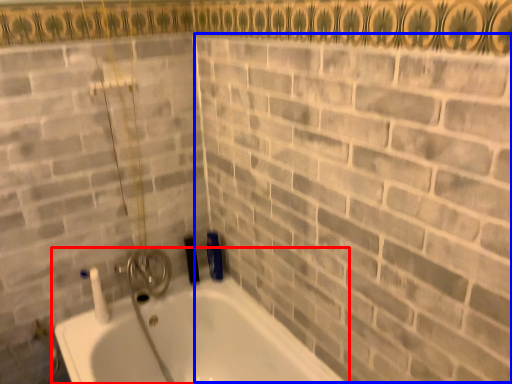
Question: Which point is closer to the camera, bathtub (highlighted by a red box) or brick (highlighted by a blue box)?

Choices:
 (A) bathtub
 (B) brick

Answer: (B)